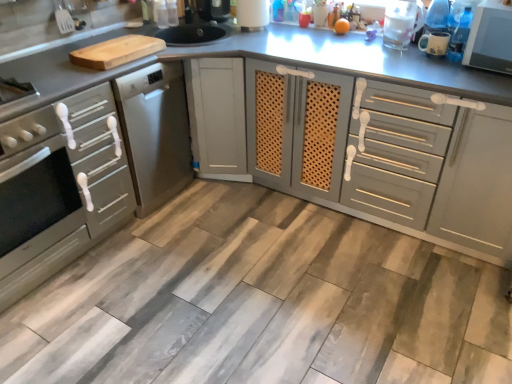
Question: Is matte gray oven at left, which is the first cabinetry in left-to-right order, thinner than white glossy microwave at upper right?

Choices:
 (A) no
 (B) yes

Answer: (A)

Question: Would you say white glossy microwave at upper right is part of matte gray oven at left, which appears as the second cabinetry when viewed from the right,'s contents?

Choices:
 (A) no
 (B) yes

Answer: (A)

Question: Is matte gray oven at left, which is the first cabinetry in left-to-right order, not near white glossy microwave at upper right?

Choices:
 (A) yes
 (B) no

Answer: (A)

Question: Does matte gray oven at left, which is the first cabinetry in left-to-right order, have a greater width compared to white glossy microwave at upper right?

Choices:
 (A) no
 (B) yes

Answer: (B)

Question: Is matte gray oven at left, which appears as the second cabinetry when viewed from the right, at the right side of white glossy microwave at upper right?

Choices:
 (A) no
 (B) yes

Answer: (A)

Question: From the image's perspective, is matte gray oven at left, which is the first cabinetry in left-to-right order, above white glossy microwave at upper right?

Choices:
 (A) no
 (B) yes

Answer: (A)

Question: From the image's perspective, is transparent plastic pitcher at upper right, the 2th appliance from the front, on top of satin silver oven at left?

Choices:
 (A) no
 (B) yes

Answer: (B)

Question: Would you consider transparent plastic pitcher at upper right, the 2th appliance viewed from the back, to be distant from satin silver oven at left?

Choices:
 (A) no
 (B) yes

Answer: (B)

Question: Is transparent plastic pitcher at upper right, the second appliance positioned from the right, bigger than satin silver oven at left?

Choices:
 (A) no
 (B) yes

Answer: (A)

Question: Does transparent plastic pitcher at upper right, the second appliance positioned from the right, turn towards satin silver oven at left?

Choices:
 (A) yes
 (B) no

Answer: (B)

Question: From the image's perspective, is transparent plastic pitcher at upper right, the 2th appliance from the front, located beneath satin silver oven at left?

Choices:
 (A) no
 (B) yes

Answer: (A)

Question: Can you confirm if transparent plastic pitcher at upper right, the 2th appliance viewed from the back, is positioned to the left of satin silver oven at left?

Choices:
 (A) no
 (B) yes

Answer: (A)

Question: Could you tell me if satin silver oven at left is turned towards matte gray oven at left, which is the first cabinetry in left-to-right order?

Choices:
 (A) yes
 (B) no

Answer: (B)